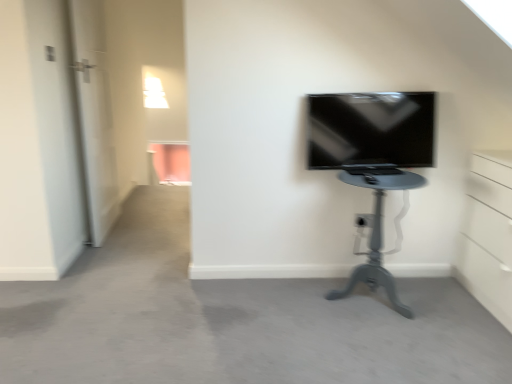
This screenshot has width=512, height=384. What do you see at coordinates (371, 130) in the screenshot?
I see `black glossy tv at upper right` at bounding box center [371, 130].

Identify the location of black glossy tv at upper right. This screenshot has height=384, width=512. (371, 130).

What do you see at coordinates (377, 230) in the screenshot? The width and height of the screenshot is (512, 384). I see `matte gray table at center` at bounding box center [377, 230].

Find the location of `matte gray table at center`. matte gray table at center is located at coordinates (377, 230).

Identify the location of black glossy tv at upper right. (371, 130).

Which is more to the right, matte gray table at center or black glossy tv at upper right?

From the viewer's perspective, matte gray table at center appears more on the right side.

Who is more distant, matte gray table at center or black glossy tv at upper right?

black glossy tv at upper right.

Which is in front, point (360, 173) or point (384, 144)?

The point (360, 173) is in front.

From the image's perspective, is matte gray table at center positioned above or below black glossy tv at upper right?

Clearly, from the image's perspective, matte gray table at center is below black glossy tv at upper right.

Looking at this image, from a real-world perspective, which object stands above the other?

From a 3D spatial view, black glossy tv at upper right is above.

Between matte gray table at center and black glossy tv at upper right, which one has smaller width?

black glossy tv at upper right is thinner.

Does matte gray table at center have a greater height compared to black glossy tv at upper right?

Indeed, matte gray table at center has a greater height compared to black glossy tv at upper right.

Can you confirm if matte gray table at center is bigger than black glossy tv at upper right?

Correct, matte gray table at center is larger in size than black glossy tv at upper right.

Would you say matte gray table at center contains black glossy tv at upper right?

Definitely not — black glossy tv at upper right is not inside matte gray table at center.

Is matte gray table at center beside black glossy tv at upper right?

matte gray table at center and black glossy tv at upper right are not in contact.

Is matte gray table at center turned away from black glossy tv at upper right?

No, matte gray table at center is not facing away from black glossy tv at upper right.

Can you tell me how much matte gray table at center and black glossy tv at upper right differ in facing direction?

There is a 0.118-degree angle between the facing directions of matte gray table at center and black glossy tv at upper right.

From the picture: Measure the distance from matte gray table at center to black glossy tv at upper right.

A distance of 10.95 inches exists between matte gray table at center and black glossy tv at upper right.

In the image, there is a black glossy tv at upper right. At what (x,y) coordinates should I click in order to perform the action: click on furniture below it (from a real-world perspective). Please return your answer as a coordinate pair (x, y). This screenshot has width=512, height=384. Looking at the image, I should click on (377, 230).

Which object is positioned more to the left, black glossy tv at upper right or matte gray table at center?

Positioned to the left is black glossy tv at upper right.

Which object is further away from the camera taking this photo, black glossy tv at upper right or matte gray table at center?

black glossy tv at upper right is further away from the camera.

Does point (421, 126) come farther from viewer compared to point (391, 170)?

That is True.

From the image's perspective, is black glossy tv at upper right over matte gray table at center?

Yes, from the image's perspective, black glossy tv at upper right is over matte gray table at center.

From a real-world perspective, which object rests below the other?

matte gray table at center is physically lower.

Considering the relative sizes of black glossy tv at upper right and matte gray table at center in the image provided, is black glossy tv at upper right wider than matte gray table at center?

In fact, black glossy tv at upper right might be narrower than matte gray table at center.

Based on the photo, which of these two, black glossy tv at upper right or matte gray table at center, stands shorter?

black glossy tv at upper right is shorter.

Is black glossy tv at upper right smaller than matte gray table at center?

Yes, black glossy tv at upper right is smaller than matte gray table at center.

Is black glossy tv at upper right situated inside matte gray table at center or outside?

black glossy tv at upper right exists outside the volume of matte gray table at center.

Based on the photo, is black glossy tv at upper right with matte gray table at center?

No, black glossy tv at upper right is not in contact with matte gray table at center.

In the scene shown: Is matte gray table at center at the back of black glossy tv at upper right?

No, black glossy tv at upper right is not facing away from matte gray table at center.

How different are the orientations of black glossy tv at upper right and matte gray table at center in degrees?

0.118 degrees.

Where is `television behind the matte gray table at center`? Image resolution: width=512 pixels, height=384 pixels. television behind the matte gray table at center is located at coordinates (371, 130).

You are a GUI agent. You are given a task and a screenshot of the screen. Output one action in this format:
    pyautogui.click(x=<x>, y=<y>)
    Task: Click on the television that is above the matte gray table at center (from the image's perspective)
    
    Given the screenshot: What is the action you would take?
    click(x=371, y=130)

You are a GUI agent. You are given a task and a screenshot of the screen. Output one action in this format:
    pyautogui.click(x=<x>, y=<y>)
    Task: Click on the furniture below the black glossy tv at upper right (from the image's perspective)
    The image size is (512, 384).
    Given the screenshot: What is the action you would take?
    pyautogui.click(x=377, y=230)